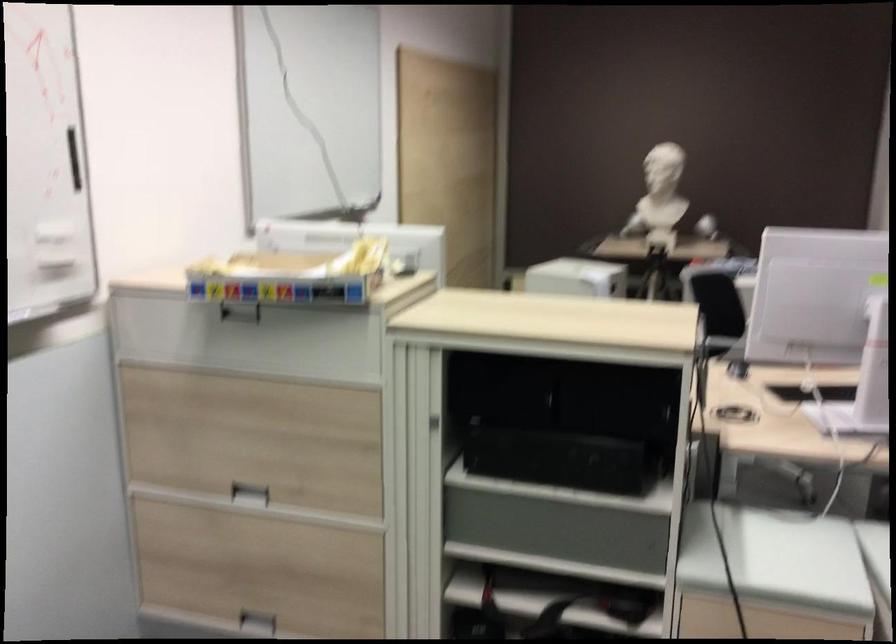
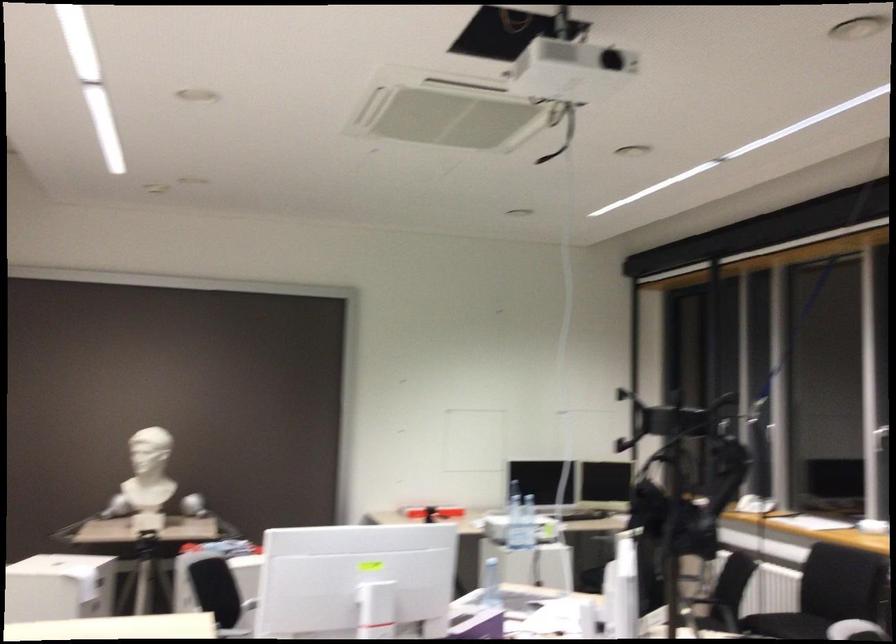
Based on the continuous images, in which direction is the camera rotating?

The camera's rotation is toward right-up.